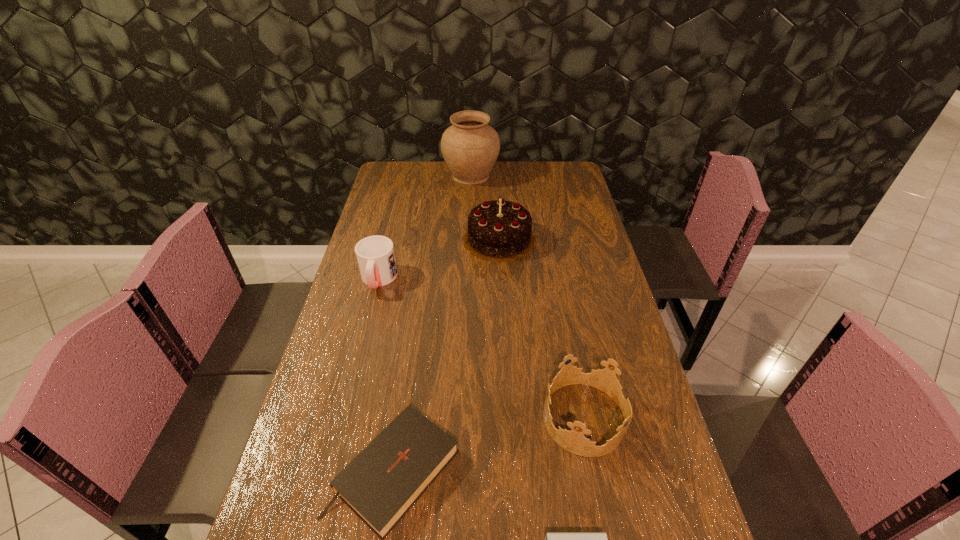
Find the location of a particular element. The width and height of the screenshot is (960, 540). unoccupied area between the mug and the tallest object is located at coordinates (424, 227).

Select which object appears as the closest to the alarm clock. Please provide its 2D coordinates. Your answer should be formatted as a tuple, i.e. [(x, y)], where the tuple contains the x and y coordinates of a point satisfying the conditions above.

[(574, 441)]

The width and height of the screenshot is (960, 540). What are the coordinates of `object that is the fourth closest one to the alarm clock` in the screenshot? It's located at (500, 231).